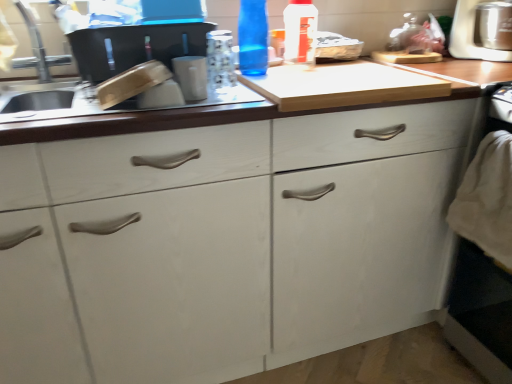
Question: Considering the positions of white matte cabinet at center and stainless steel food processor at upper right in the image, is white matte cabinet at center wider or thinner than stainless steel food processor at upper right?

Choices:
 (A) wide
 (B) thin

Answer: (A)

Question: Is white matte cabinet at center taller or shorter than stainless steel food processor at upper right?

Choices:
 (A) tall
 (B) short

Answer: (A)

Question: Which object is positioned closest to the brushed metal faucet at upper left?

Choices:
 (A) stainless steel food processor at upper right
 (B) transparent plastic bottle at upper center, marked as the 1th bottle in a right-to-left arrangement
 (C) white matte cabinet at center
 (D) blue glass bottle at upper center, the 1th bottle when ordered from left to right

Answer: (D)

Question: Which of these objects is positioned farthest from the white matte cabinet at center?

Choices:
 (A) transparent plastic bottle at upper center, marked as the 1th bottle in a right-to-left arrangement
 (B) brushed metal faucet at upper left
 (C) stainless steel food processor at upper right
 (D) blue glass bottle at upper center, arranged as the second bottle when viewed from the right

Answer: (C)